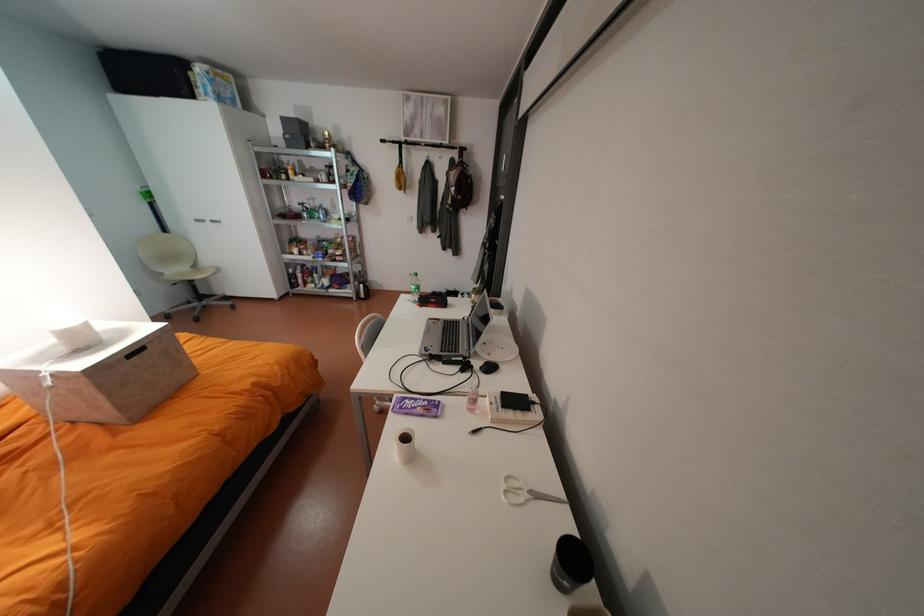
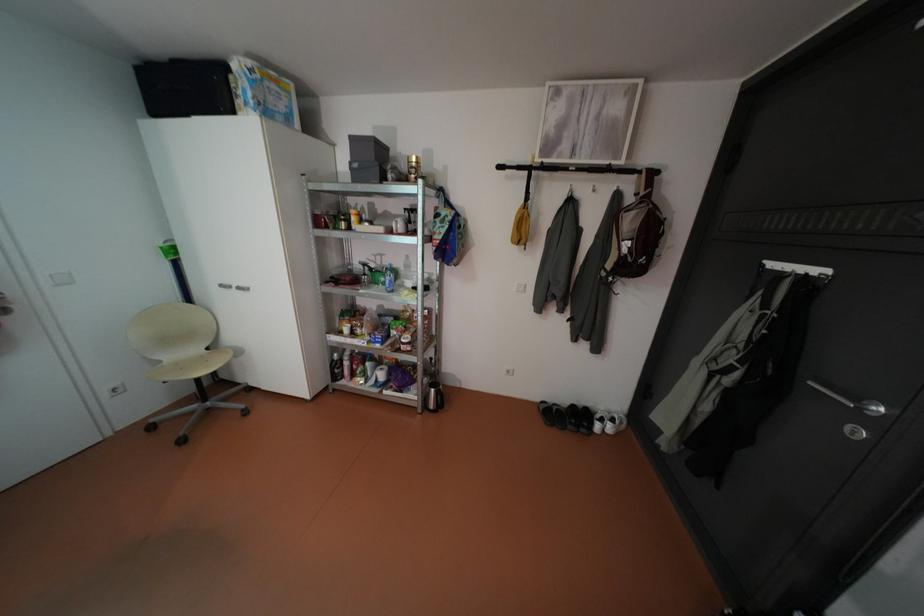
Find the pixel in the second image that matches the point at 392,140 in the first image.

(508, 166)